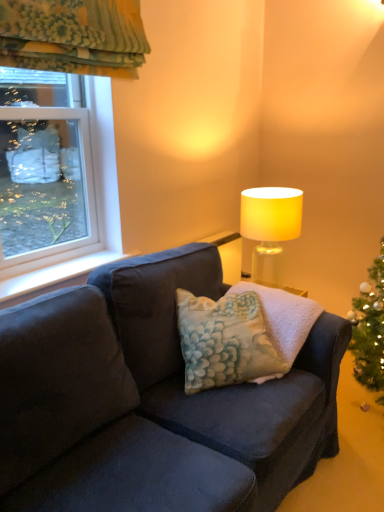
Question: Does white smooth window sill at left appear on the right side of matte yellow lampshade at upper right?

Choices:
 (A) no
 (B) yes

Answer: (A)

Question: Is white smooth window sill at left thinner than matte yellow lampshade at upper right?

Choices:
 (A) no
 (B) yes

Answer: (B)

Question: Is white smooth window sill at left next to matte yellow lampshade at upper right and touching it?

Choices:
 (A) yes
 (B) no

Answer: (B)

Question: Does white smooth window sill at left come in front of matte yellow lampshade at upper right?

Choices:
 (A) no
 (B) yes

Answer: (B)

Question: Is white smooth window sill at left outside matte yellow lampshade at upper right?

Choices:
 (A) no
 (B) yes

Answer: (B)

Question: Can you confirm if white smooth window sill at left is smaller than matte yellow lampshade at upper right?

Choices:
 (A) no
 (B) yes

Answer: (B)

Question: Are matte yellow lampshade at upper right and white smooth window sill at left located far from each other?

Choices:
 (A) no
 (B) yes

Answer: (A)

Question: Is white smooth window sill at left at the back of matte yellow lampshade at upper right?

Choices:
 (A) yes
 (B) no

Answer: (B)

Question: Is matte yellow lampshade at upper right positioned behind white smooth window sill at left?

Choices:
 (A) yes
 (B) no

Answer: (A)

Question: Considering the relative sizes of matte yellow lampshade at upper right and white smooth window sill at left in the image provided, is matte yellow lampshade at upper right shorter than white smooth window sill at left?

Choices:
 (A) yes
 (B) no

Answer: (B)

Question: Does matte yellow lampshade at upper right have a larger size compared to white smooth window sill at left?

Choices:
 (A) yes
 (B) no

Answer: (A)

Question: Could white smooth window sill at left be considered to be inside matte yellow lampshade at upper right?

Choices:
 (A) no
 (B) yes

Answer: (A)

Question: From a real-world perspective, does clear glass window at upper left sit lower than fluffy fabric pillow at center?

Choices:
 (A) no
 (B) yes

Answer: (A)